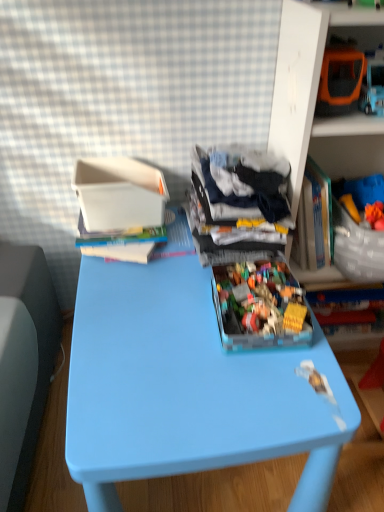
Question: Is dark blue fabric at center aimed at orange plastic toy car at upper right, the 2th shelf from the right?

Choices:
 (A) no
 (B) yes

Answer: (A)

Question: Does dark blue fabric at center have a lesser height compared to orange plastic toy car at upper right, the first shelf viewed from the left?

Choices:
 (A) no
 (B) yes

Answer: (A)

Question: Is dark blue fabric at center to the left of orange plastic toy car at upper right, the first shelf viewed from the left, from the viewer's perspective?

Choices:
 (A) no
 (B) yes

Answer: (B)

Question: From a real-world perspective, is dark blue fabric at center on top of orange plastic toy car at upper right, the first shelf viewed from the left?

Choices:
 (A) yes
 (B) no

Answer: (B)

Question: Is dark blue fabric at center far away from orange plastic toy car at upper right, the first shelf viewed from the left?

Choices:
 (A) yes
 (B) no

Answer: (B)

Question: Is blue plastic table at center situated inside translucent plastic container at upper right, arranged as the 1th shelf when viewed from the right, or outside?

Choices:
 (A) outside
 (B) inside

Answer: (A)

Question: From the image's perspective, relative to translucent plastic container at upper right, arranged as the 1th shelf when viewed from the right, is blue plastic table at center above or below?

Choices:
 (A) below
 (B) above

Answer: (A)

Question: From their relative heights in the image, would you say blue plastic table at center is taller or shorter than translucent plastic container at upper right, arranged as the 1th shelf when viewed from the right?

Choices:
 (A) short
 (B) tall

Answer: (A)

Question: Considering the positions of blue plastic table at center and translucent plastic container at upper right, marked as the second shelf in a left-to-right arrangement, in the image, is blue plastic table at center bigger or smaller than translucent plastic container at upper right, marked as the second shelf in a left-to-right arrangement,?

Choices:
 (A) big
 (B) small

Answer: (A)

Question: Considering the positions of translucent plastic container at upper right, arranged as the 1th shelf when viewed from the right, and blue plastic table at center in the image, is translucent plastic container at upper right, arranged as the 1th shelf when viewed from the right, taller or shorter than blue plastic table at center?

Choices:
 (A) short
 (B) tall

Answer: (B)

Question: Considering the positions of point (304, 139) and point (208, 409), is point (304, 139) closer or farther from the camera than point (208, 409)?

Choices:
 (A) farther
 (B) closer

Answer: (A)

Question: From a real-world perspective, is translucent plastic container at upper right, marked as the second shelf in a left-to-right arrangement, above or below blue plastic table at center?

Choices:
 (A) above
 (B) below

Answer: (A)

Question: Considering the positions of translucent plastic container at upper right, marked as the second shelf in a left-to-right arrangement, and blue plastic table at center in the image, is translucent plastic container at upper right, marked as the second shelf in a left-to-right arrangement, wider or thinner than blue plastic table at center?

Choices:
 (A) wide
 (B) thin

Answer: (B)

Question: Considering the positions of point (236, 437) and point (246, 173), is point (236, 437) closer or farther from the camera than point (246, 173)?

Choices:
 (A) closer
 (B) farther

Answer: (A)

Question: In the image, is blue plastic table at center positioned in front of or behind dark blue fabric at center?

Choices:
 (A) behind
 (B) front

Answer: (B)